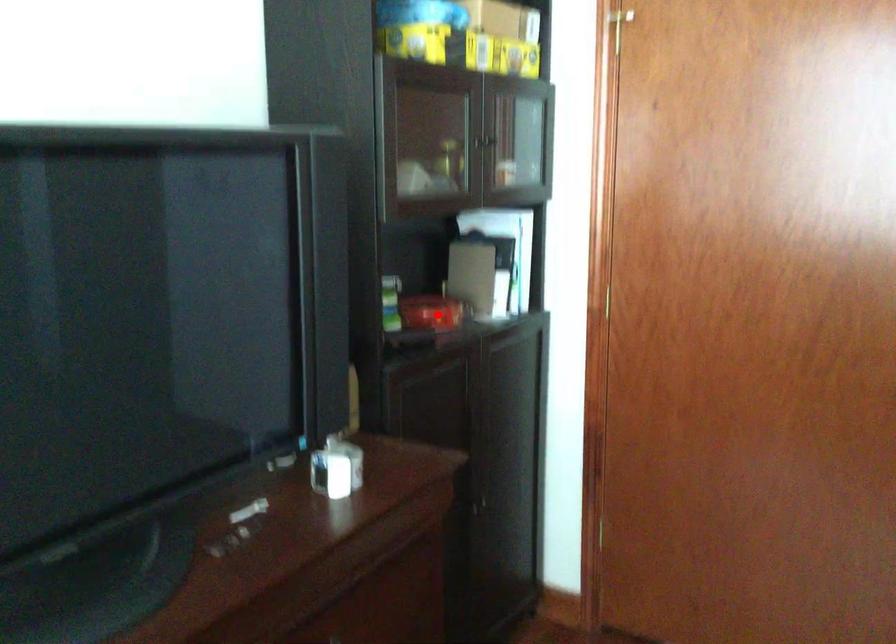
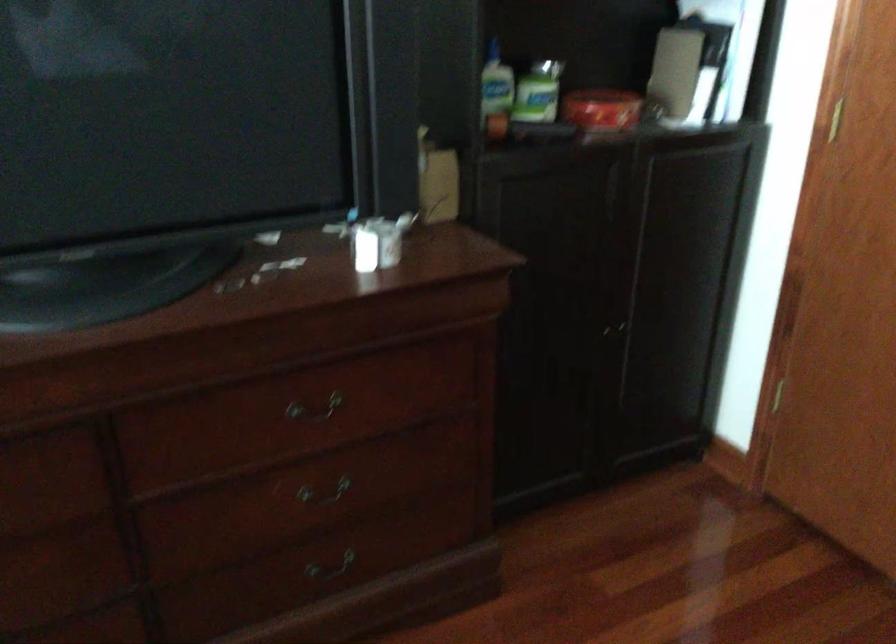
In the second image, find the point that corresponds to the highlighted location in the first image.

(600, 109)